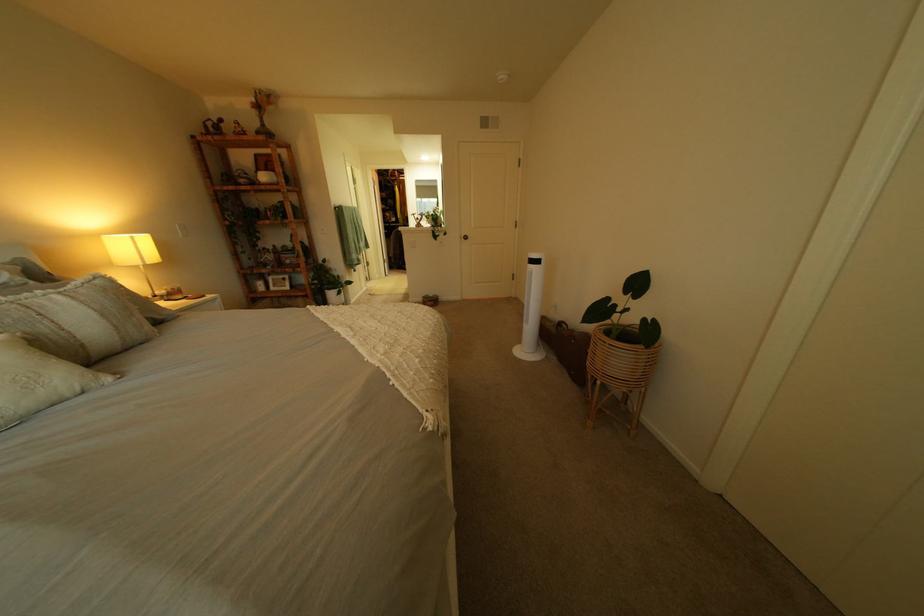
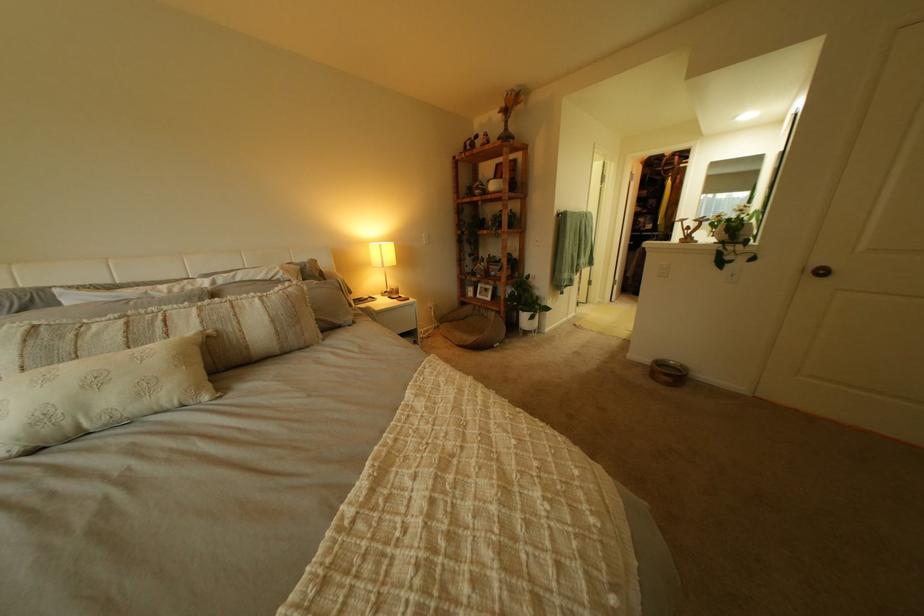
Question: The camera is either moving clockwise (left) or counter-clockwise (right) around the object. The first image is from the beginning of the video and the second image is from the end. Is the camera moving left or right when shooting the video?

Choices:
 (A) Left
 (B) Right

Answer: (B)